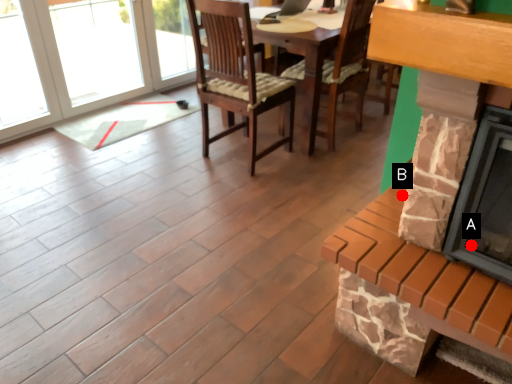
Question: Two points are circled on the image, labeled by A and B beside each circle. Which point appears closest to the camera in this image?

Choices:
 (A) A is closer
 (B) B is closer

Answer: (A)